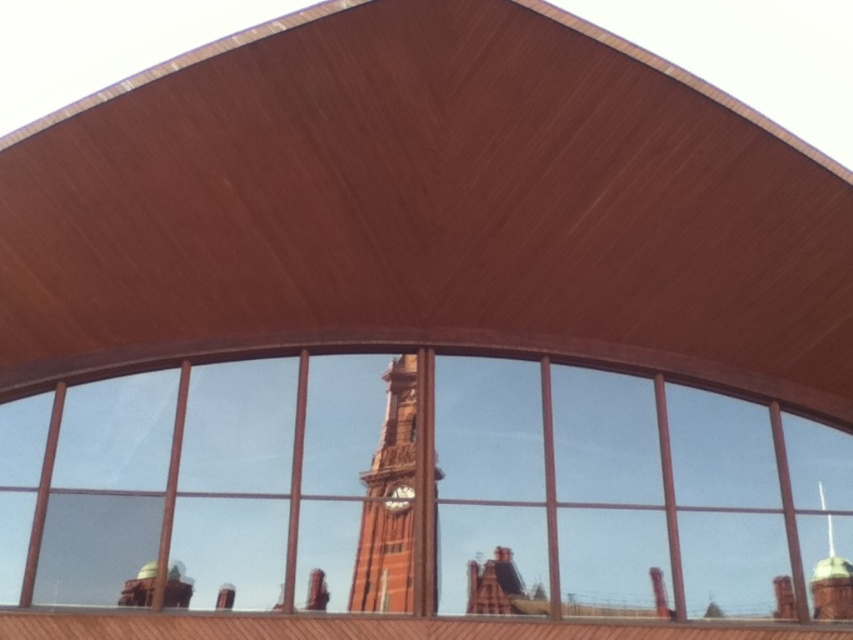
You are standing in front of the modern architectural structure and want to touch both the clear glass window at center and the matte brown clock at center. Which one can you reach first without moving your position?

The clear glass window at center is closer to the viewer than the matte brown clock at center, so you can reach the clear glass window at center first without moving your position.

You are an architect designing a new building and want to ensure that the red brick clock tower at center and the matte brown clock at center are positioned in a way that they do not block each other when viewed from the front entrance. Given their current distance apart, can you confirm if they will not obstruct each other?

The red brick clock tower at center is 17.03 inches away from the matte brown clock at center, so they are positioned far enough apart to avoid obstructing each other when viewed from the front entrance.

Looking at this image, you are standing in front of the modern building and want to take a photo of the red brick clock tower at center through the clear glass window at center. Will the reflection of the clock tower be visible in the window?

The clear glass window at center is closer to the viewer than the red brick clock tower at center, so the reflection of the clock tower would not be visible in the window since the window is in front of the tower.